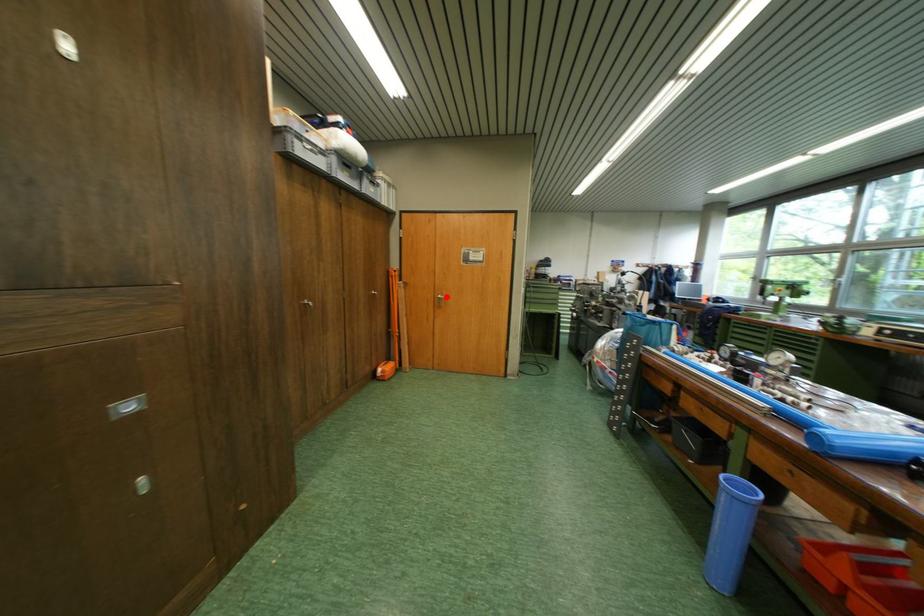
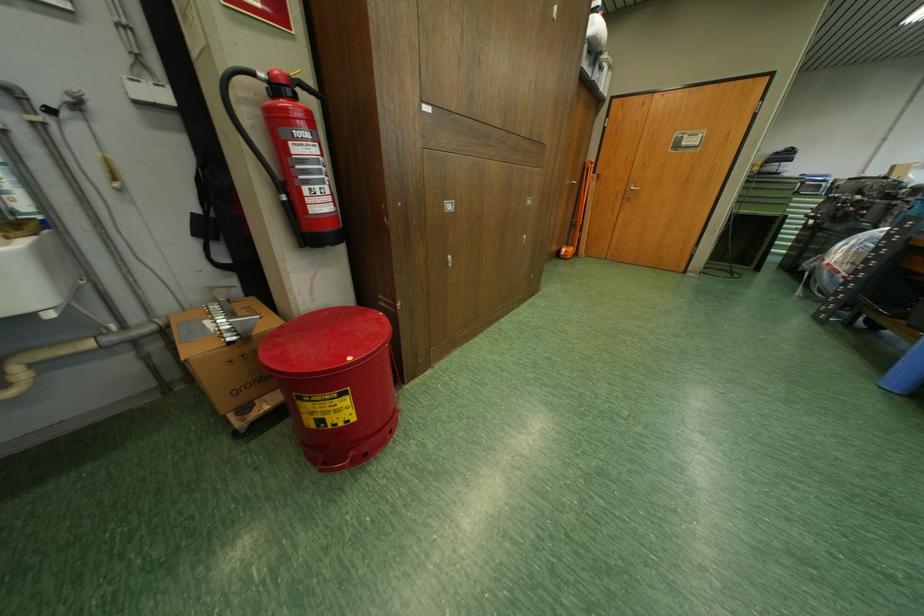
Where in the second image is the point corresponding to the highlighted location from the first image?

(638, 188)